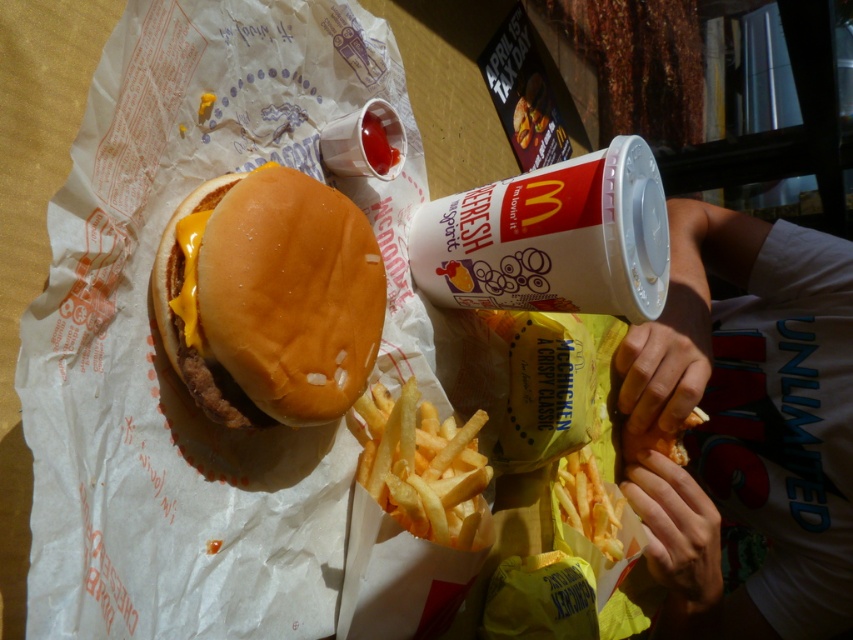
Does white cotton shirt at upper right have a greater height compared to golden crispy french fries at center?

Yes.

Between white cotton shirt at upper right and golden crispy french fries at center, which one is positioned higher?

golden crispy french fries at center is above.

Locate an element on the screen. The height and width of the screenshot is (640, 853). white cotton shirt at upper right is located at coordinates (746, 426).

Identify the location of white cotton shirt at upper right. (746, 426).

Is slightly toasted bun at center thinner than golden crispy french fries at center?

A: No.

In order to click on slightly toasted bun at center in this screenshot , I will do `click(270, 298)`.

What do you see at coordinates (270, 298) in the screenshot? I see `slightly toasted bun at center` at bounding box center [270, 298].

Where is `slightly toasted bun at center`? The image size is (853, 640). slightly toasted bun at center is located at coordinates (270, 298).

Is white cotton shirt at upper right below yellow crispy french fries at lower center?

No.

Is point (844, 396) in front of point (605, 493)?

That is False.

Between point (792, 330) and point (575, 497), which one is positioned behind?

The point (792, 330) is more distant.

Find the location of a particular element. The image size is (853, 640). white cotton shirt at upper right is located at coordinates (746, 426).